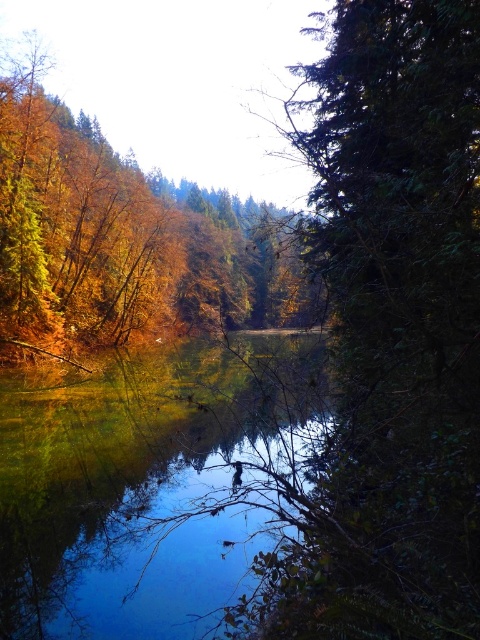
Who is positioned more to the left, green matte tree at right or shiny reflective water at center?

From the viewer's perspective, shiny reflective water at center appears more on the left side.

Which is behind, point (290, 614) or point (130, 476)?

The point (130, 476) is behind.

Does point (336, 436) lie behind point (159, 468)?

No.

Locate an element on the screen. This screenshot has width=480, height=640. green matte tree at right is located at coordinates (393, 333).